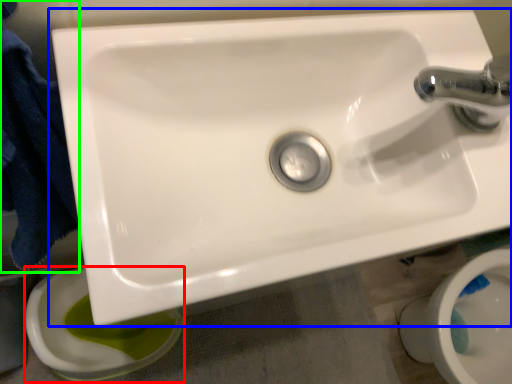
Question: Based on their relative distances, which object is farther from toilet bowl (highlighted by a red box)? Choose from sink (highlighted by a blue box) and bath towel (highlighted by a green box).

Choices:
 (A) sink
 (B) bath towel

Answer: (A)